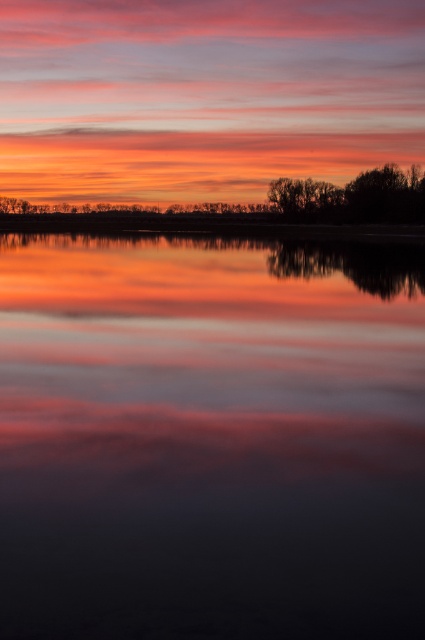
Is smooth water at center to the left of silhouette tree at center from the viewer's perspective?

Yes, smooth water at center is to the left of silhouette tree at center.

Does smooth water at center have a lesser width compared to silhouette tree at center?

In fact, smooth water at center might be wider than silhouette tree at center.

Who is more forward, [260,516] or [316,180]?

Point [260,516] is in front.

Locate an element on the screen. smooth water at center is located at coordinates (210, 438).

Can you confirm if smooth water at center is taller than silhouette tree at right?

No.

Is smooth water at center positioned before silhouette tree at right?

Yes.

Between point (6, 566) and point (356, 205), which one is positioned in front?

Positioned in front is point (6, 566).

You are a GUI agent. You are given a task and a screenshot of the screen. Output one action in this format:
    pyautogui.click(x=<x>, y=<y>)
    Task: Click on the smooth water at center
    This screenshot has height=640, width=425.
    Given the screenshot: What is the action you would take?
    pyautogui.click(x=210, y=438)

Is silhouette tree at right to the left of silhouette tree at center from the viewer's perspective?

No, silhouette tree at right is not to the left of silhouette tree at center.

How distant is silhouette tree at right from silhouette tree at center?

silhouette tree at right is 2.31 meters from silhouette tree at center.

Does point (371, 188) lie in front of point (311, 211)?

Yes, it is.

Identify the location of silhouette tree at right. The width and height of the screenshot is (425, 640). (354, 196).